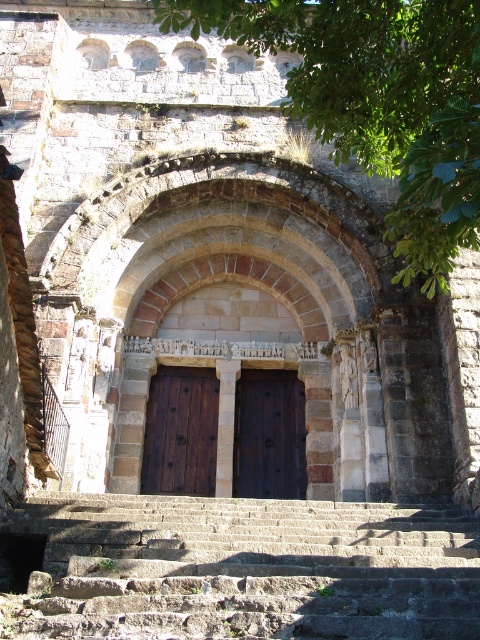
You are a visitor at the entrance of a historic stone building. You see a brown wooden door at center and a dark wood door at center. Which door should you enter to access the main hall?

The brown wooden door at center has a larger size compared to the dark wood door at center, so it is more likely the main entrance and should be used to access the main hall.

You are standing in front of the historic stone building entrance. You need to locate the point at coordinates (180,432). Where exactly is this point located on the brown wooden door at center?

The point at coordinates 0.677, 0.377 is located on the brown wooden door at center.

You are standing at the entrance of the historic stone building and notice two points marked in the image. The first point is at coordinates point (469, 524) and the second is at point (187, 449). Which of these two points is closer to you as you face the building?

Point (469, 524) is in front of point (187, 449), so it is closer to you as you face the building.